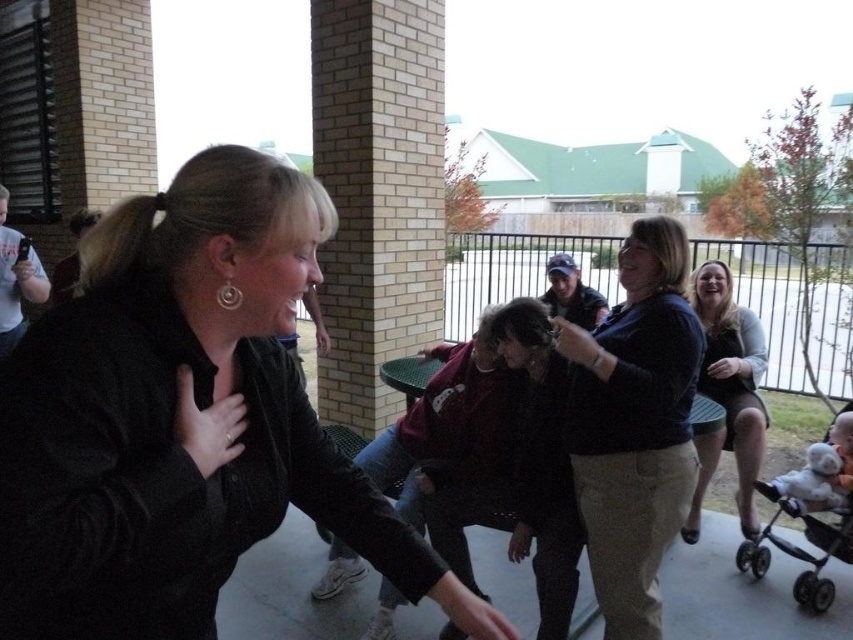
Question: Is matte black dress at right closer to camera compared to black plastic baby carriage at lower right?

Choices:
 (A) yes
 (B) no

Answer: (B)

Question: Which object is positioned farthest from the dark blue sweater at center?

Choices:
 (A) white plush toy at lower right
 (B) black plastic baby carriage at lower right

Answer: (A)

Question: Which of the following is the farthest from the observer?

Choices:
 (A) (729, 429)
 (B) (772, 516)
 (C) (599, 524)
 (D) (843, 442)

Answer: (A)

Question: Can you confirm if black matte jacket at left is positioned to the left of white plush toy at lower right?

Choices:
 (A) yes
 (B) no

Answer: (A)

Question: Based on their relative distances, which object is farther from the black matte jacket at left?

Choices:
 (A) black plastic baby carriage at lower right
 (B) dark blue sweater at center
 (C) white plush toy at lower right
 (D) matte black dress at right

Answer: (C)

Question: Can you confirm if black matte jacket at left is bigger than white plush toy at lower right?

Choices:
 (A) no
 (B) yes

Answer: (B)